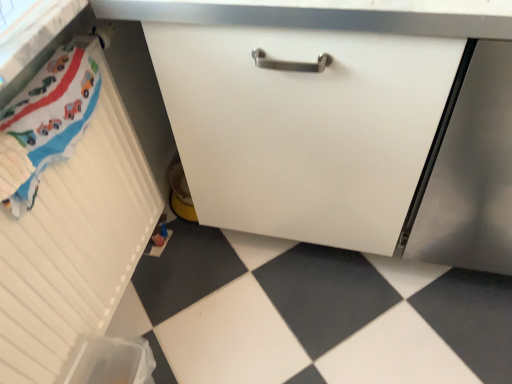
Locate an element on the screen. free location to the right of white matte radiator at left, the second cabinetry when ordered from right to left is located at coordinates (241, 317).